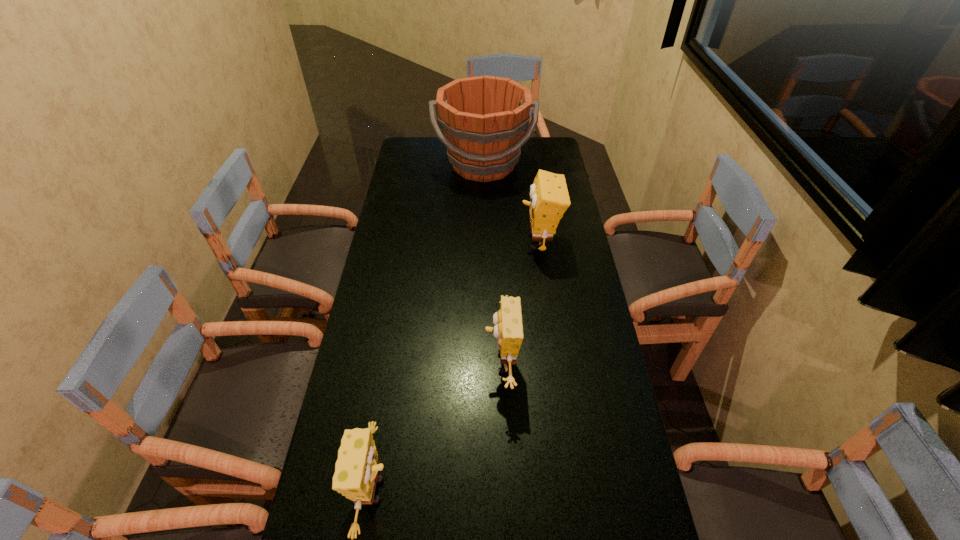
Locate an element on the screen. This screenshot has width=960, height=540. vacant area situated 0.230m on the face of the second nearest object is located at coordinates (403, 363).

Identify the location of vacant space positioned 0.170m on the face of the second nearest object. Image resolution: width=960 pixels, height=540 pixels. (424, 363).

Where is `free space located 0.100m on the face of the second nearest object`? free space located 0.100m on the face of the second nearest object is located at coordinates (449, 363).

You are a GUI agent. You are given a task and a screenshot of the screen. Output one action in this format:
    pyautogui.click(x=<x>, y=<y>)
    Task: Click on the object at the far edge
    The height and width of the screenshot is (540, 960).
    Given the screenshot: What is the action you would take?
    pyautogui.click(x=483, y=118)

Find the location of `object situated at the left edge`. object situated at the left edge is located at coordinates (483, 118).

The height and width of the screenshot is (540, 960). I want to click on bucket positioned at the right edge, so click(x=483, y=118).

Identify the location of sponge located in the right edge section of the desktop. Image resolution: width=960 pixels, height=540 pixels. (549, 195).

Find the location of `object located in the far left corner section of the desktop`. object located in the far left corner section of the desktop is located at coordinates (483, 118).

This screenshot has width=960, height=540. I want to click on object located in the far right corner section of the desktop, so click(483, 118).

I want to click on vacant space at the left edge of the desktop, so click(372, 354).